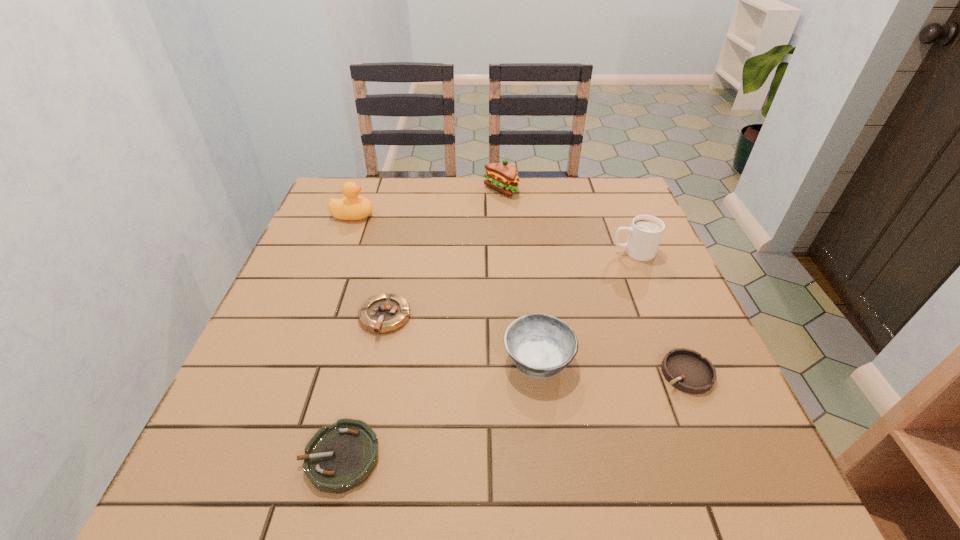
The height and width of the screenshot is (540, 960). In order to click on object that is the fourth closest one to the cappuccino in this screenshot , I will do `click(383, 313)`.

Identify which ashtray is located as the nearest to the rightmost ashtray. Please provide its 2D coordinates. Your answer should be formatted as a tuple, i.e. [(x, y)], where the tuple contains the x and y coordinates of a point satisfying the conditions above.

[(540, 345)]

Locate an element on the screen. ashtray object that ranks as the closest to the third farthest object is located at coordinates (540, 345).

The width and height of the screenshot is (960, 540). What are the coordinates of `vacant region that satisfies the following two spatial constraints: 1. on the back side of the nearest object; 2. on the left side of the second ashtray from right to left` in the screenshot? It's located at (364, 360).

I want to click on free space that satisfies the following two spatial constraints: 1. on the face of the leftmost object; 2. on the left side of the shortest object, so tap(262, 457).

This screenshot has width=960, height=540. Identify the location of vacant area in the image that satisfies the following two spatial constraints: 1. on the face of the duck; 2. on the back side of the rightmost ashtray. (294, 373).

This screenshot has height=540, width=960. I want to click on free space in the image that satisfies the following two spatial constraints: 1. on the side with the handle of the cappuccino; 2. on the front side of the tallest ashtray, so click(x=677, y=360).

You are a GUI agent. You are given a task and a screenshot of the screen. Output one action in this format:
    pyautogui.click(x=<x>, y=<y>)
    Task: Click on the vacant space that satisfies the following two spatial constraints: 1. on the side with the handle of the third tallest object; 2. on the back side of the rightmost ashtray
    The height and width of the screenshot is (540, 960).
    Given the screenshot: What is the action you would take?
    pyautogui.click(x=683, y=373)